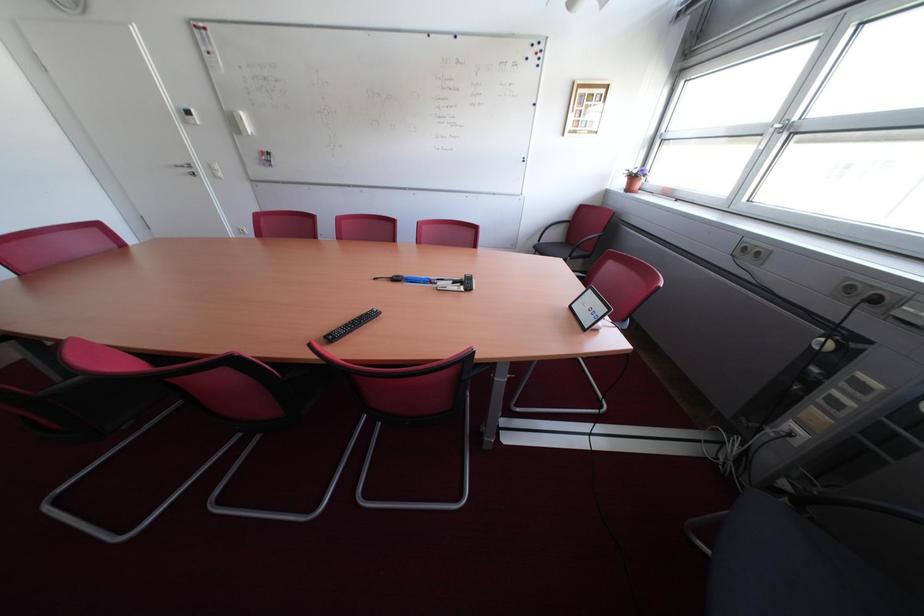
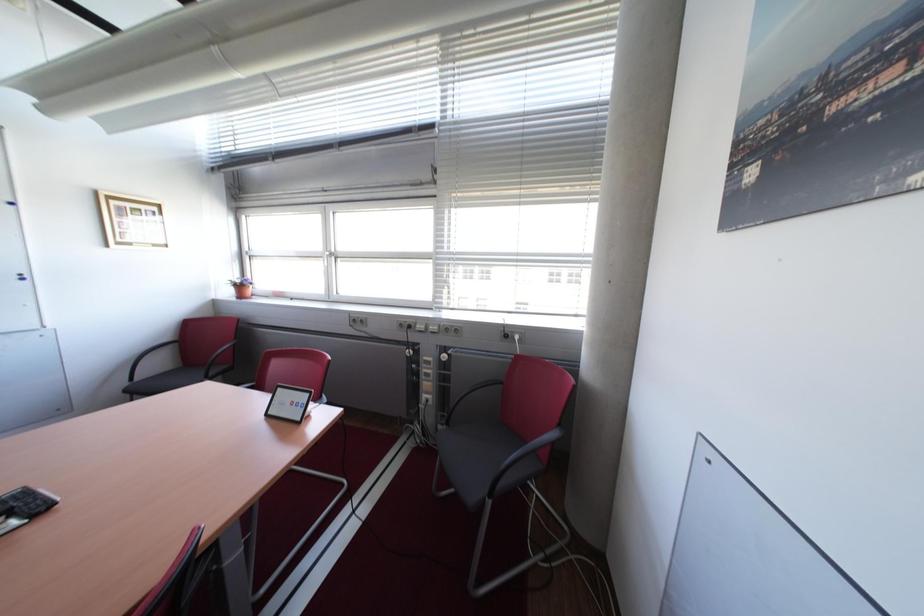
Question: How did the camera likely rotate?

Choices:
 (A) Left
 (B) Right
 (C) Up
 (D) Down

Answer: (B)